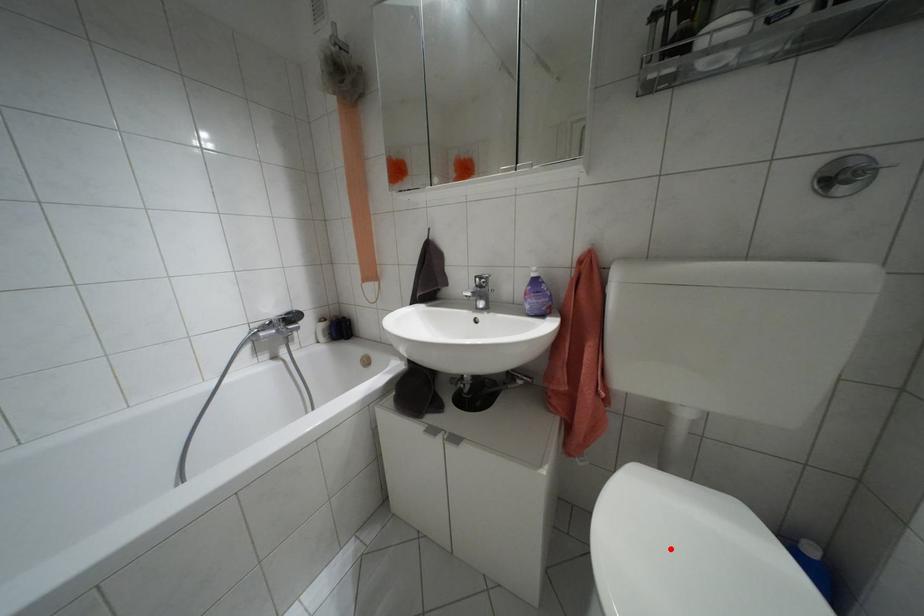
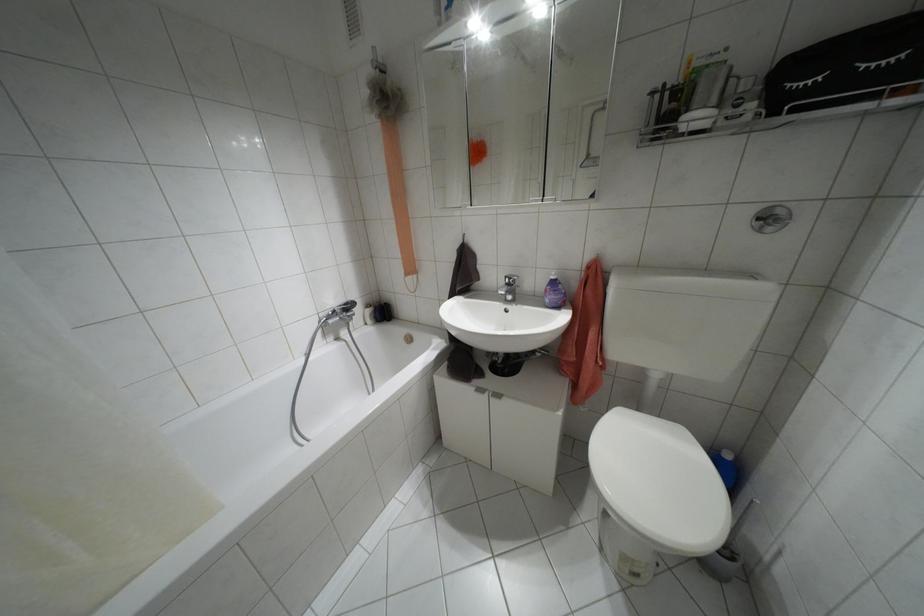
Where in the second image is the point corresponding to the highlighted location from the first image?

(643, 466)